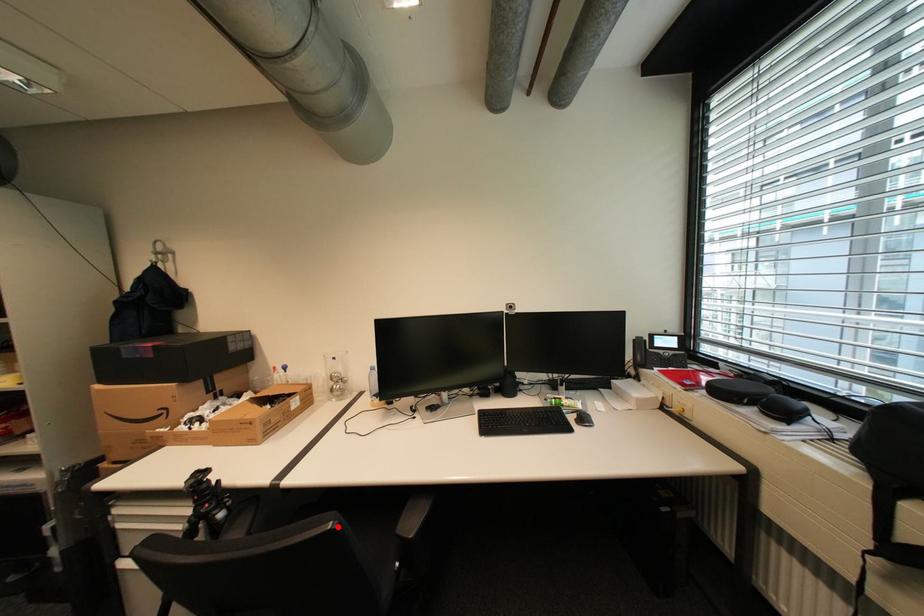
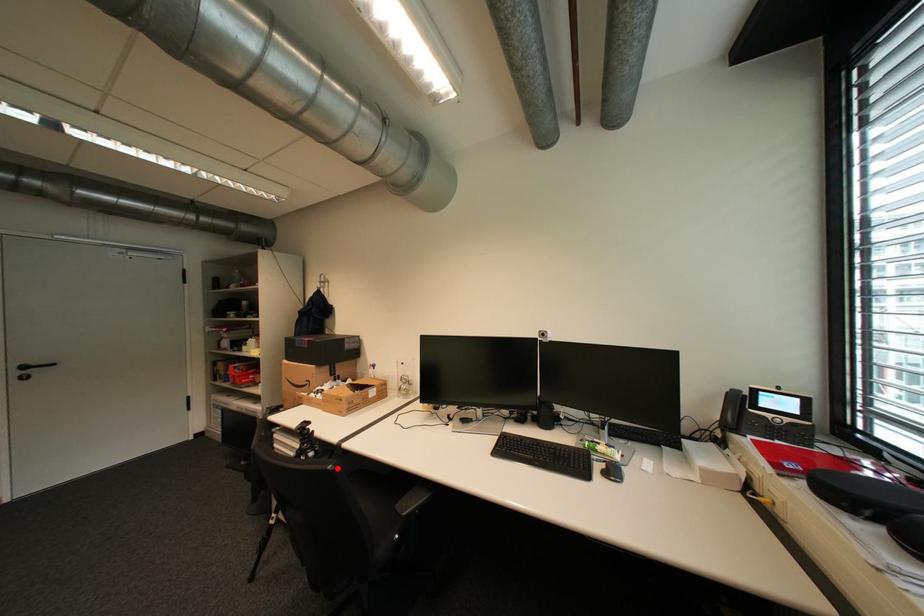
I am providing you with two images of the same scene from different viewpoints. A red point is marked on the first image and another point is marked on the second image. Do the highlighted points in image1 and image2 indicate the same real-world spot?

Yes